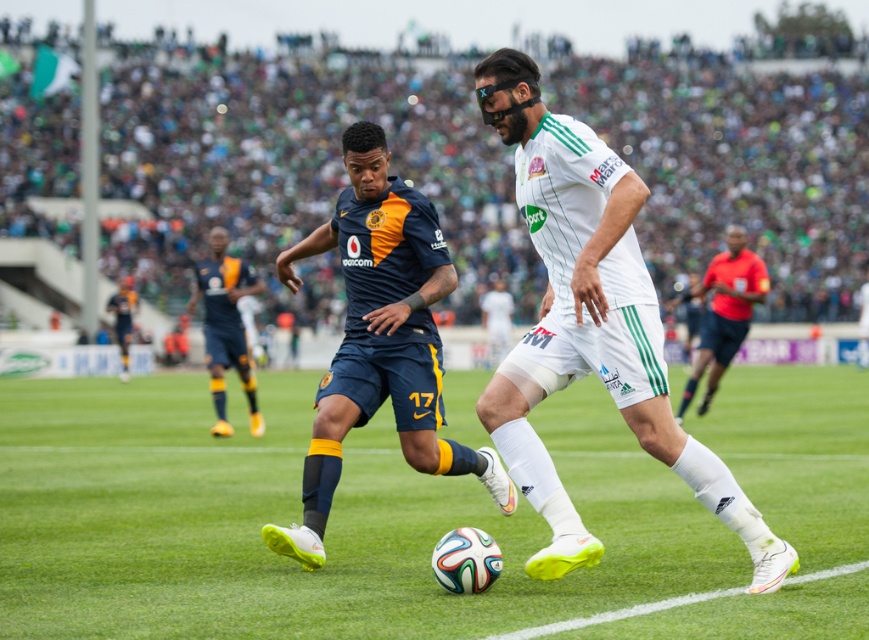
Based on the scene description, can you determine the position of the white matte soccer player at center relative to the dark blue jersey at center?

The white matte soccer player at center is positioned below the dark blue jersey at center, indicating that the player is wearing the dark blue jersey.

You are a referee observing the soccer match. You see the white matte soccer player at center and the dark blue jersey at center. Which player is positioned more to the right side of the field?

The white matte soccer player at center is positioned more to the right side of the field compared to the dark blue jersey at center.